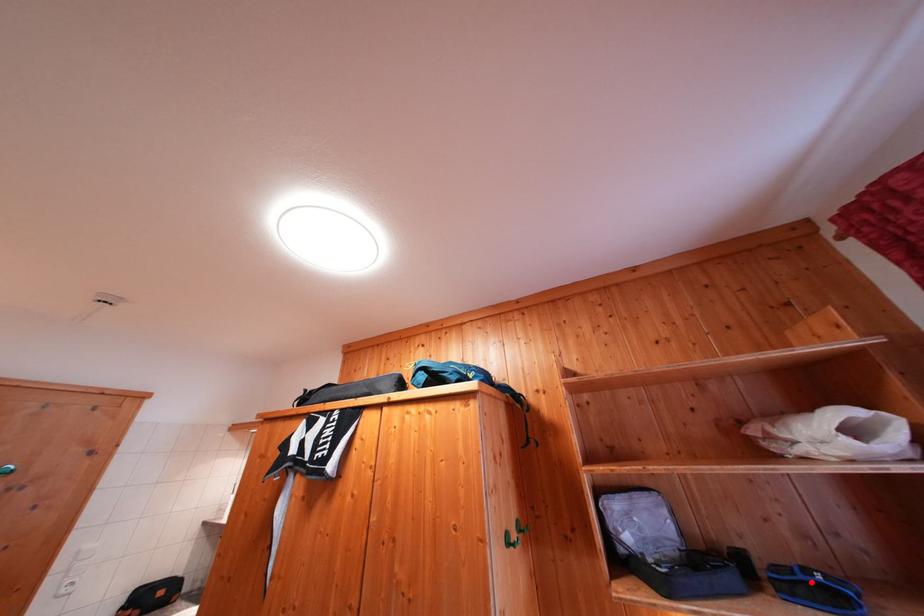
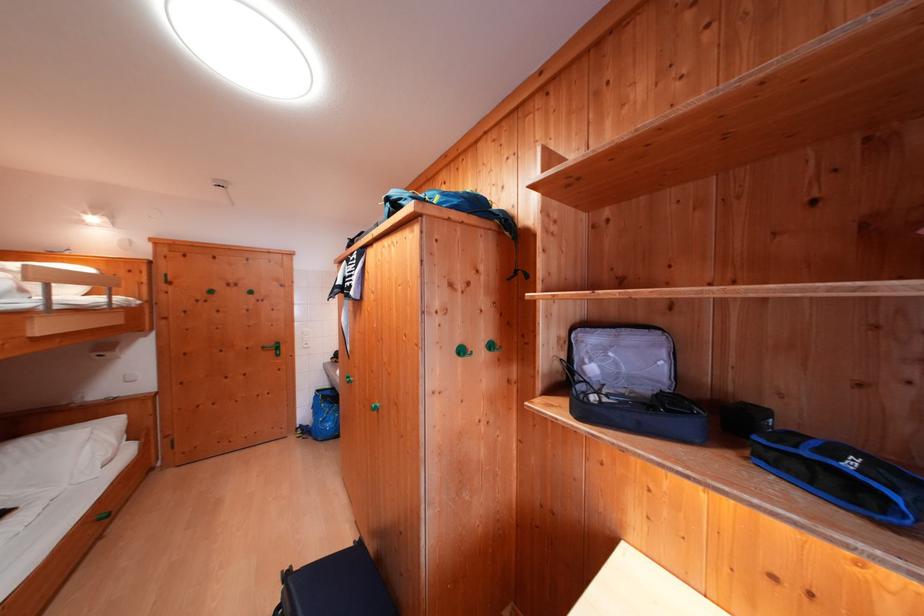
Question: I am providing you with two images of the same scene from different viewpoints. Image1 has a red point marked. In image2, the corresponding 3D location appears at what relative position? Reply with the corresponding letter.

Choices:
 (A) Closer
 (B) Farther

Answer: (B)